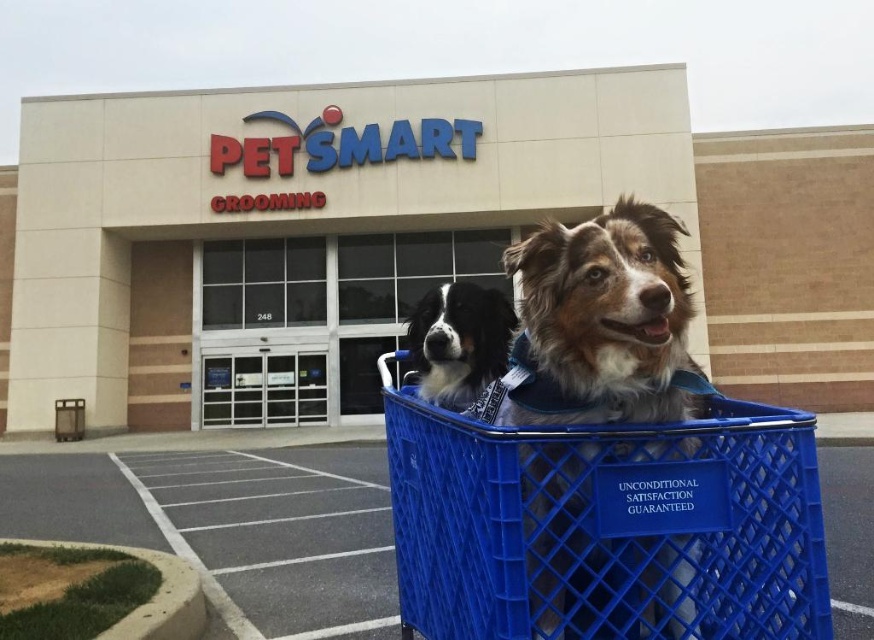
You are a delivery person who needs to deliver a package to the PetSmart store. You see the beige concrete building at center and the brown and white fur at center. Which object should you approach first to reach the store?

The beige concrete building at center is positioned on the left side of brown and white fur at center. Since the store is located at the beige concrete building at center, you should approach the beige concrete building at center first to reach the store.